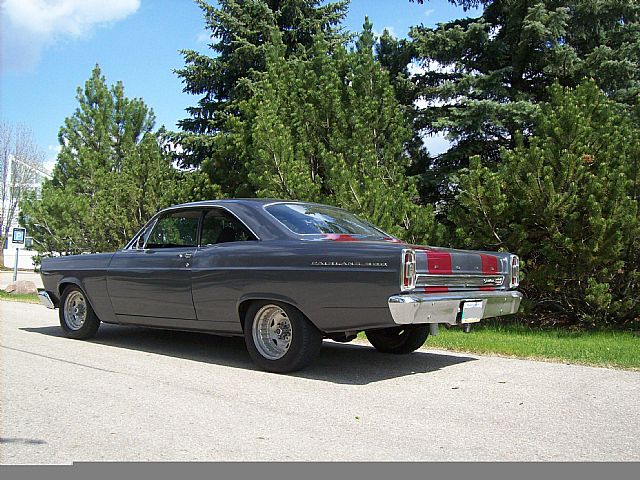
The width and height of the screenshot is (640, 480). I want to click on the left front window, so click(x=166, y=229).